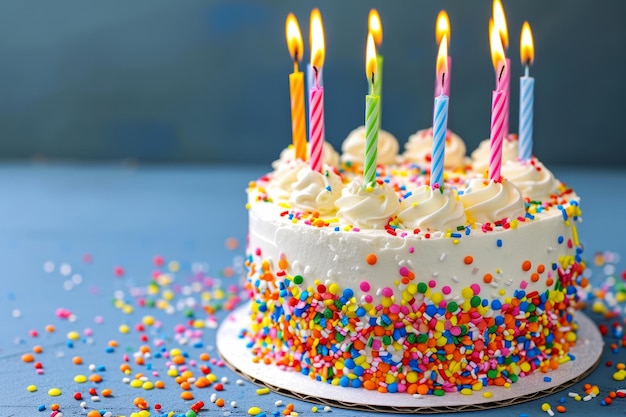
The height and width of the screenshot is (417, 626). Identify the location of candles. (x=308, y=136), (x=288, y=94), (x=313, y=72), (x=372, y=132), (x=380, y=70), (x=448, y=131), (x=439, y=66), (x=501, y=69), (x=491, y=132), (x=528, y=122).